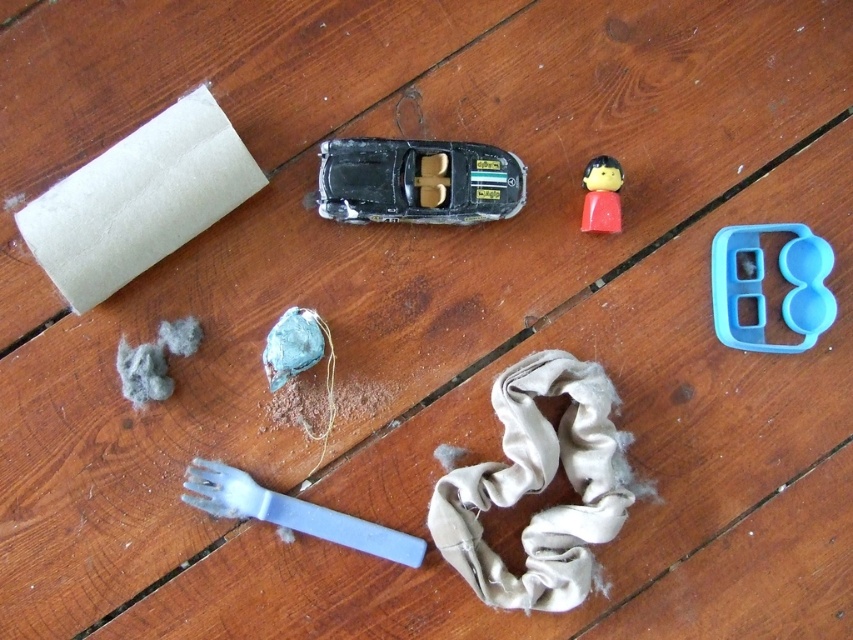
Question: Estimate the real-world distances between objects in this image. Which object is farther from the black plastic toy car at center?

Choices:
 (A) blue plastic fork at lower left
 (B) blue plastic tray at upper right
 (C) beige fabric at center

Answer: (B)

Question: Which point appears closest to the camera in this image?

Choices:
 (A) (224, 492)
 (B) (575, 464)
 (C) (604, 204)
 (D) (410, 193)

Answer: (A)

Question: In this image, where is blue plastic tray at upper right located relative to smooth plastic figure at upper right?

Choices:
 (A) below
 (B) above

Answer: (A)

Question: Considering the real-world distances, which object is farthest from the black plastic toy car at center?

Choices:
 (A) blue plastic fork at lower left
 (B) beige fabric at center
 (C) blue plastic tray at upper right
 (D) smooth plastic figure at upper right

Answer: (C)

Question: Can you confirm if beige fabric at center is thinner than blue plastic tray at upper right?

Choices:
 (A) no
 (B) yes

Answer: (A)

Question: Does black plastic toy car at center have a smaller size compared to blue plastic fork at lower left?

Choices:
 (A) no
 (B) yes

Answer: (B)